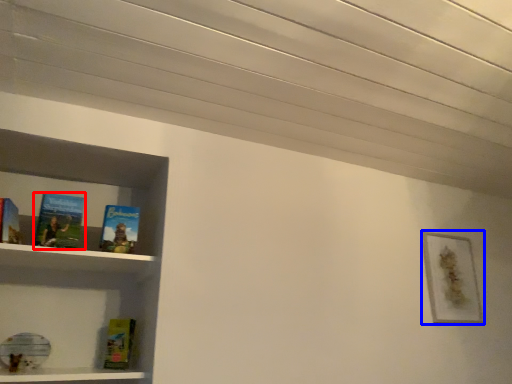
Question: Which point is further to the camera, book (highlighted by a red box) or picture frame (highlighted by a blue box)?

Choices:
 (A) book
 (B) picture frame

Answer: (B)